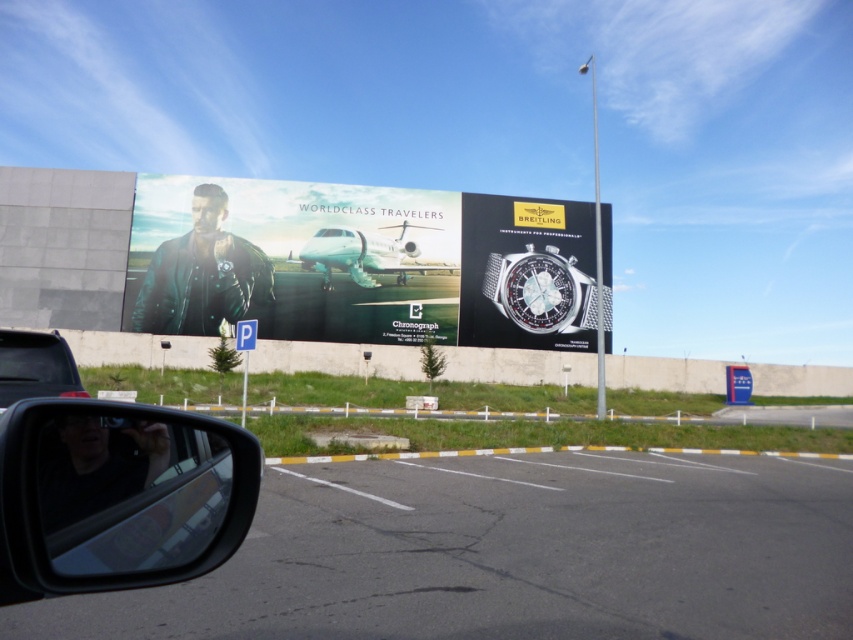
Question: Does asphalt at center have a larger size compared to polished silver watch at center?

Choices:
 (A) yes
 (B) no

Answer: (B)

Question: Which point appears closest to the camera in this image?

Choices:
 (A) (102, 426)
 (B) (462, 260)
 (C) (169, 268)
 (D) (596, 524)

Answer: (A)

Question: Which object is the closest to the matte black leather jacket at upper left?

Choices:
 (A) asphalt at center
 (B) black glossy car at lower left
 (C) transparent glass at lower left
 (D) black glossy side mirror at lower left

Answer: (B)

Question: Does black glossy side mirror at lower left have a larger size compared to polished silver watch at center?

Choices:
 (A) no
 (B) yes

Answer: (A)

Question: Is polished silver watch at center to the left of transparent glass at lower left from the viewer's perspective?

Choices:
 (A) yes
 (B) no

Answer: (B)

Question: Which object is the closest to the black glossy side mirror at lower left?

Choices:
 (A) black glossy car at lower left
 (B) transparent glass at lower left
 (C) polished silver watch at center
 (D) asphalt at center

Answer: (D)